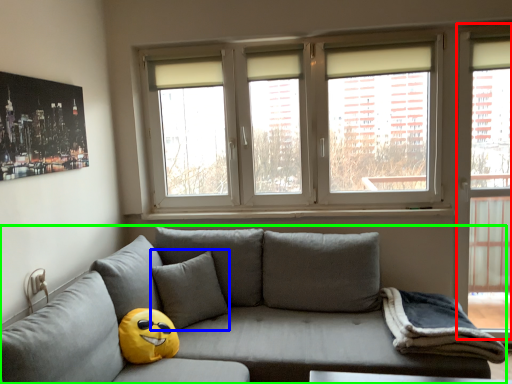
Question: Estimate the real-world distances between objects in this image. Which object is closer to glass door (highlighted by a red box), pillow (highlighted by a blue box) or studio couch (highlighted by a green box)?

Choices:
 (A) pillow
 (B) studio couch

Answer: (B)